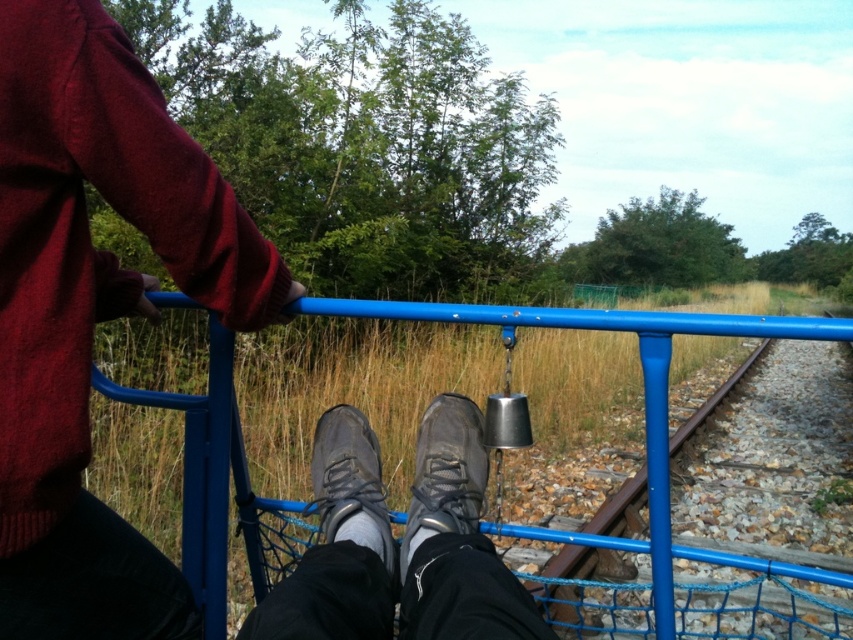
Question: Is maroon sweater at upper left bigger than dark gray fabric shoe at center?

Choices:
 (A) yes
 (B) no

Answer: (A)

Question: Which point is farther to the camera?

Choices:
 (A) dark gray fabric shoe at center
 (B) dark grey leather shoe at center
 (C) maroon sweater at upper left
 (D) leather shoes at center

Answer: (B)

Question: Is dark grey leather shoe at center further to the viewer compared to dark gray fabric shoe at center?

Choices:
 (A) no
 (B) yes

Answer: (B)

Question: Is maroon sweater at upper left to the right of dark grey leather shoe at center from the viewer's perspective?

Choices:
 (A) no
 (B) yes

Answer: (A)

Question: Which point appears farthest from the camera in this image?

Choices:
 (A) (215, 580)
 (B) (416, 611)

Answer: (A)

Question: Estimate the real-world distances between objects in this image. Which object is closer to the maroon sweater at upper left?

Choices:
 (A) leather shoes at center
 (B) dark gray fabric shoe at center
 (C) dark grey leather shoe at center

Answer: (A)